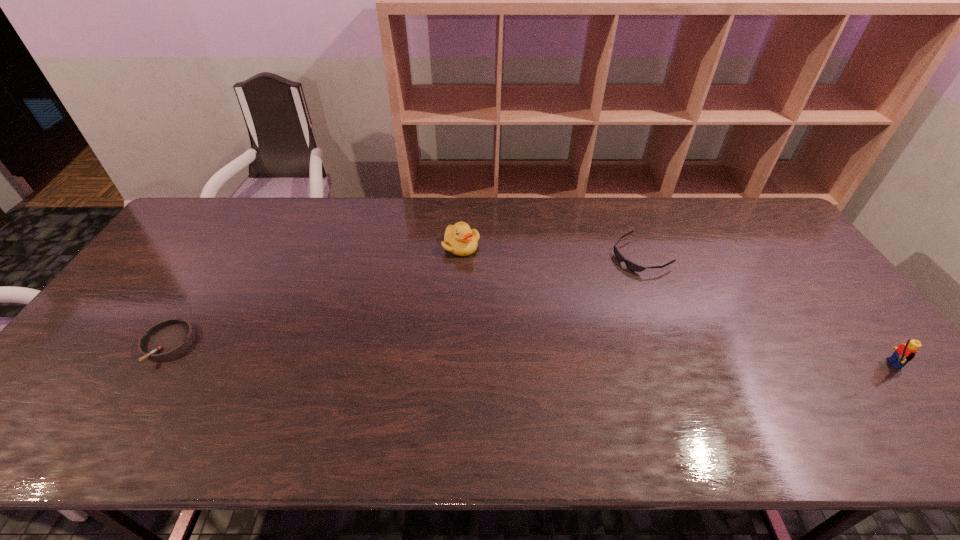
Image resolution: width=960 pixels, height=540 pixels. I want to click on object located at the near edge, so click(x=905, y=352).

At what (x,y) coordinates should I click in order to perform the action: click on object located at the left edge. Please return your answer as a coordinate pair (x, y). Looking at the image, I should click on (166, 339).

What are the coordinates of `object that is at the right edge` in the screenshot? It's located at (905, 352).

At what (x,y) coordinates should I click in order to perform the action: click on object that is at the near right corner. Please return your answer as a coordinate pair (x, y). Looking at the image, I should click on (905, 352).

Where is `vacant space at the far edge`? vacant space at the far edge is located at coordinates (491, 206).

In the image, there is a desktop. Where is `free space at the near edge`? The height and width of the screenshot is (540, 960). free space at the near edge is located at coordinates click(x=226, y=378).

Locate an element on the screen. blank area at the left edge is located at coordinates (173, 252).

At what (x,y) coordinates should I click in order to perform the action: click on blank space at the right edge of the desktop. Please return your answer as a coordinate pair (x, y). Image resolution: width=960 pixels, height=540 pixels. Looking at the image, I should click on (791, 310).

In the image, there is a desktop. At what (x,y) coordinates should I click in order to perform the action: click on vacant space at the far right corner. Please return your answer as a coordinate pair (x, y). Image resolution: width=960 pixels, height=540 pixels. Looking at the image, I should click on (753, 203).

This screenshot has width=960, height=540. I want to click on vacant area between the second object from left to right and the second object from right to left, so click(x=551, y=251).